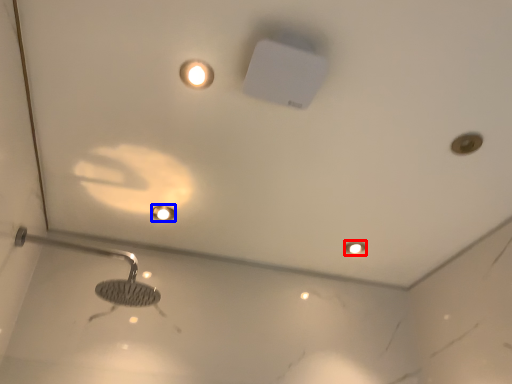
Question: Which object is closer to the camera taking this photo, light fixture (highlighted by a red box) or droplight (highlighted by a blue box)?

Choices:
 (A) light fixture
 (B) droplight

Answer: (B)